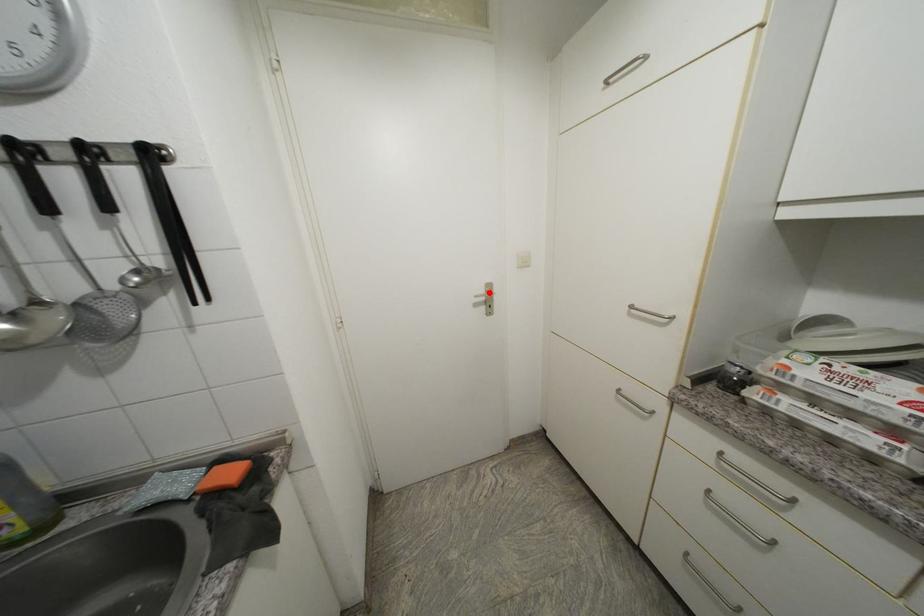
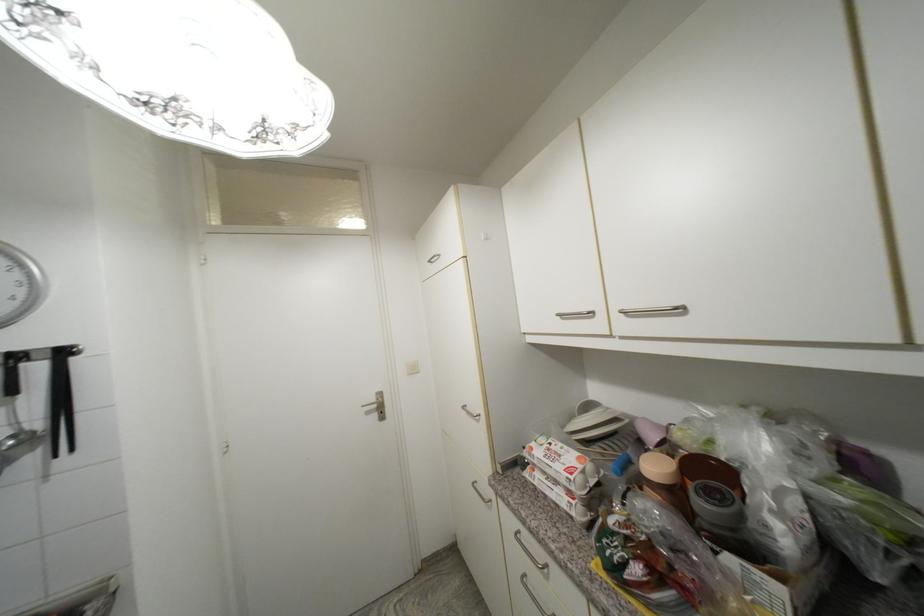
In the second image, find the point that corresponds to the highlighted location in the first image.

(380, 400)